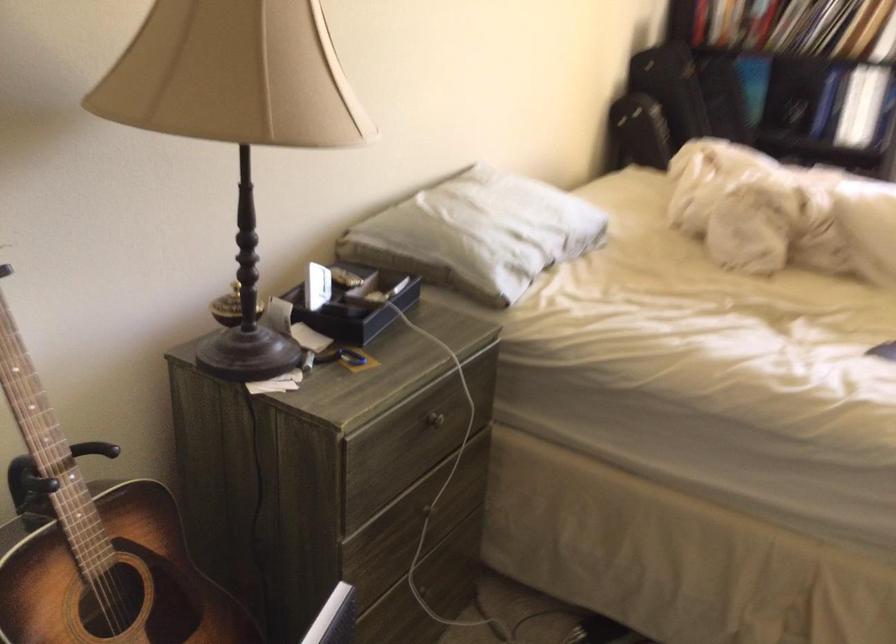
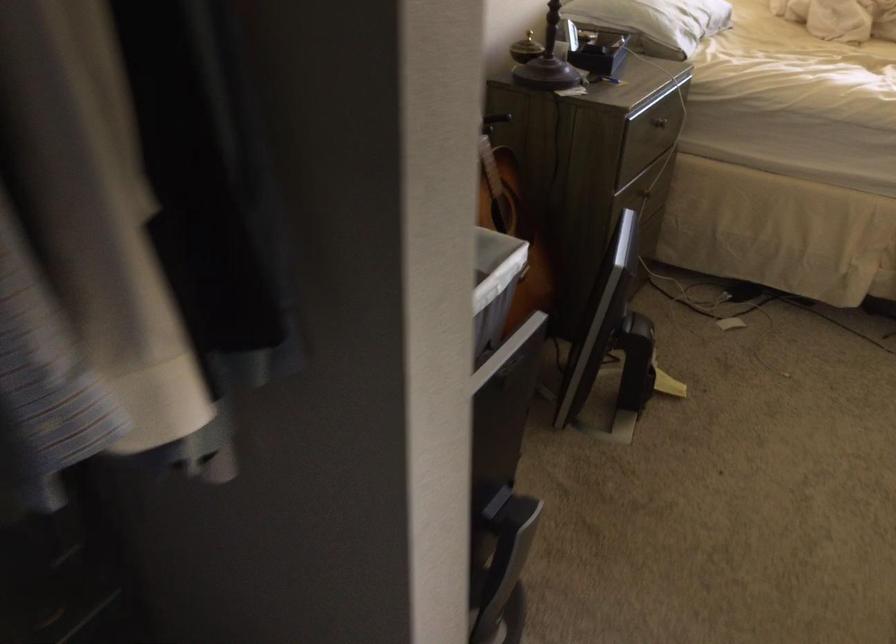
Where in the second image is the point corresponding to point 419,513 from the first image?

(645, 194)